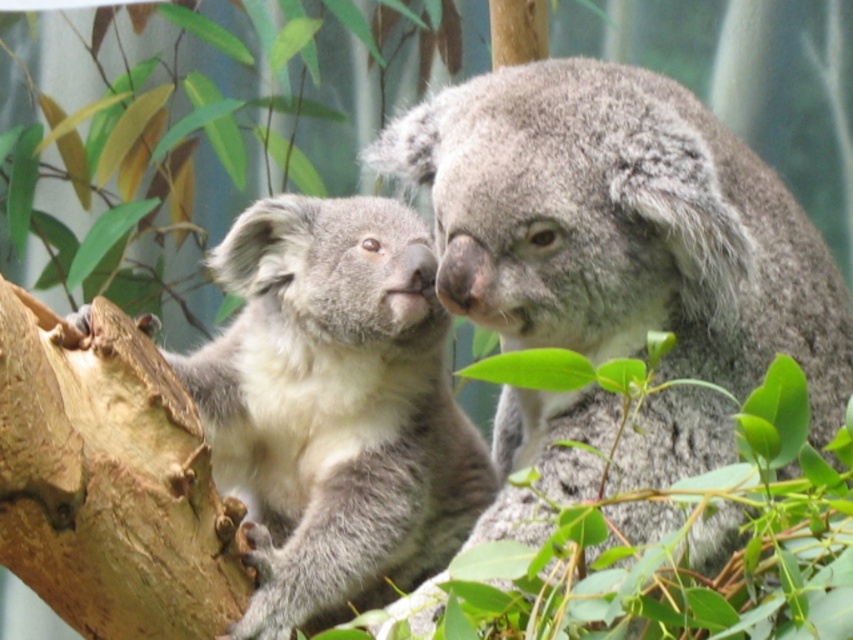
Which of these two, gray fluffy koala at center or gray furry koala at left, stands shorter?

With less height is gray furry koala at left.

Is gray fluffy koala at center above gray furry koala at left?

Yes.

Is point (622, 332) positioned after point (267, 584)?

No, (622, 332) is in front of (267, 584).

Where is `gray fluffy koala at center`? The height and width of the screenshot is (640, 853). gray fluffy koala at center is located at coordinates (622, 227).